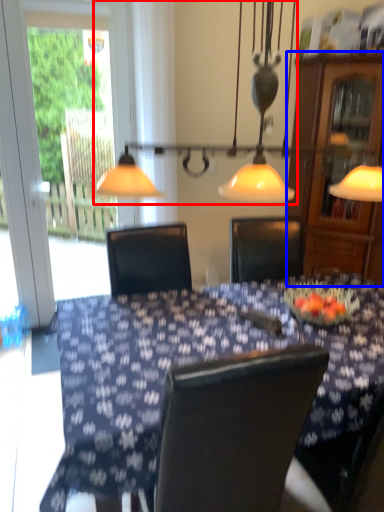
Question: Among these objects, which one is farthest to the camera, lamp (highlighted by a red box) or cabinetry (highlighted by a blue box)?

Choices:
 (A) lamp
 (B) cabinetry

Answer: (B)